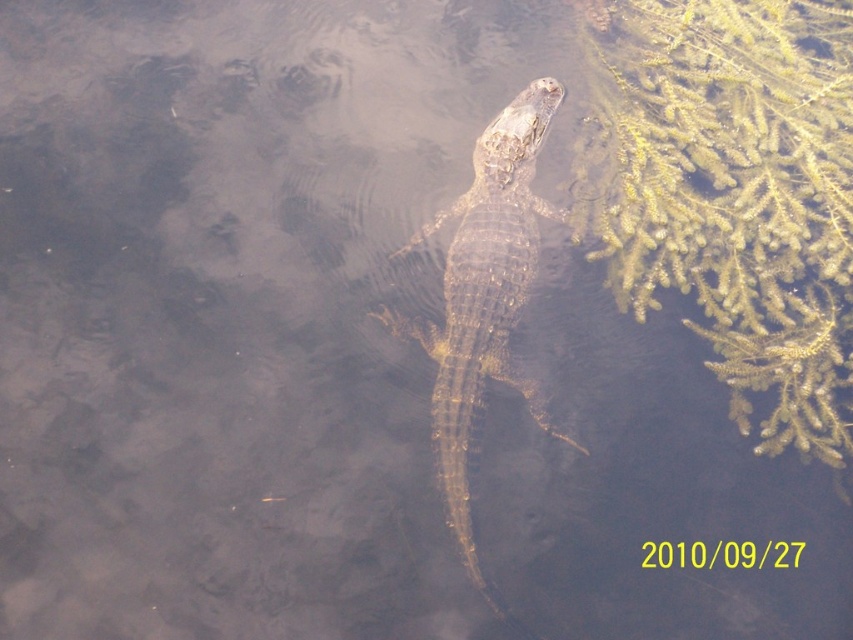
Consider the image. You are a wildlife photographer aiming to capture a clear photo of the crocodile while avoiding the green mossy plant at right. Based on their positions, can you position yourself so that the crocodile is fully visible without the plant overlapping in the frame?

The green mossy plant at right is located at point [733,193]. Since the crocodile is positioned centrally with its head and back visible, you can adjust your angle to ensure the plant does not overlap by positioning yourself slightly to the left of the crocodile, allowing the plant at the right to be out of the frame.

You are a wildlife photographer trying to capture a closeup of the shiny brown crocodile at center without disturbing the surrounding green mossy plant at right. Based on their sizes, which object should you focus on first to ensure you can frame both in the shot?

The green mossy plant at right is larger in size than the shiny brown crocodile at center, so you should focus on the green mossy plant at right first to ensure it fits within the frame before adjusting for the smaller crocodile.

You are a photographer trying to capture a clear shot of the shiny brown crocodile at center. However, the green mossy plant at right is blocking your view. Can you estimate whether the plant is taller than the crocodile to determine if you need to adjust your camera angle upwards or downwards?

The green mossy plant at right has a greater height compared to the shiny brown crocodile at center. Therefore, to capture a clear shot, you should adjust your camera angle upwards to avoid the obstruction caused by the taller plant.